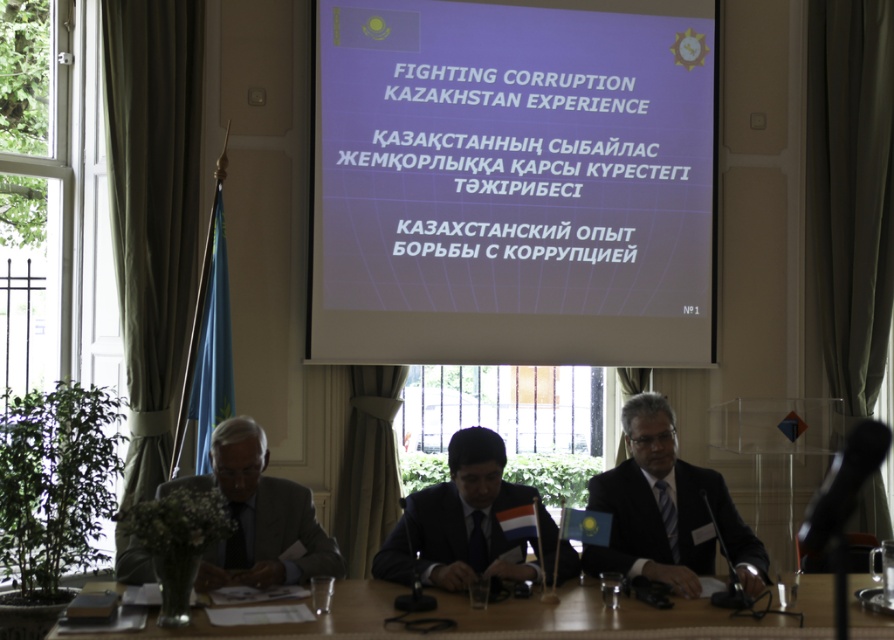
Question: Based on their relative distances, which object is farther from the gray suit at left?

Choices:
 (A) white glossy projection screen at center
 (B) dark suit at center

Answer: (A)

Question: Is white glossy projection screen at center above wooden table at center?

Choices:
 (A) no
 (B) yes

Answer: (B)

Question: Can you confirm if dark suit at center is positioned to the left of dark blue suit at center?

Choices:
 (A) yes
 (B) no

Answer: (B)

Question: Among these objects, which one is nearest to the camera?

Choices:
 (A) white glossy projection screen at center
 (B) gray suit at left
 (C) dark blue suit at center

Answer: (B)

Question: Which point appears closest to the camera in this image?

Choices:
 (A) (478, 445)
 (B) (299, 528)
 (C) (689, 44)

Answer: (A)

Question: Can you confirm if dark blue suit at center is thinner than gray suit at left?

Choices:
 (A) yes
 (B) no

Answer: (B)